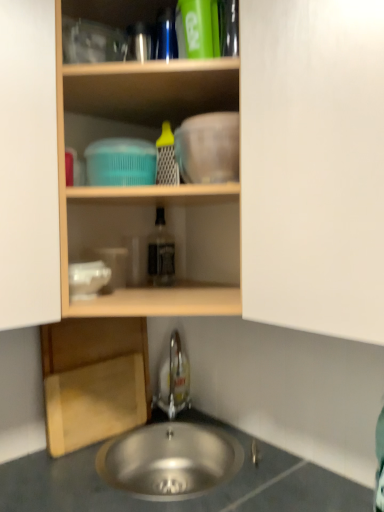
Describe the element at coordinates (184, 500) in the screenshot. This screenshot has width=384, height=512. I see `metallic gray sink at lower center` at that location.

Describe the element at coordinates (313, 165) in the screenshot. I see `white matte cabinet at center` at that location.

The width and height of the screenshot is (384, 512). What do you see at coordinates (161, 252) in the screenshot? I see `translucent glass bottle at center` at bounding box center [161, 252].

Identify the location of stainless steel sink at lower center. tap(169, 460).

In order to click on metallic gray sink at lower center in this screenshot , I will do `click(184, 500)`.

Is point (338, 84) closer or farther from the camera than point (165, 265)?

Point (338, 84) is positioned closer to the camera compared to point (165, 265).

Is white matte cabinet at center facing towards translucent glass bottle at center?

No, white matte cabinet at center is not oriented towards translucent glass bottle at center.

From the image's perspective, is white matte cabinet at center over translucent glass bottle at center?

Indeed, from the image's perspective, white matte cabinet at center is shown above translucent glass bottle at center.

From a real-world perspective, does white matte cabinet at center stand above translucent glass bottle at center?

Indeed, from a real-world perspective, white matte cabinet at center stands above translucent glass bottle at center.

From a real-world perspective, is white matte cabinet at center above or below stainless steel sink at lower center?

white matte cabinet at center is above stainless steel sink at lower center.

Considering the positions of objects white matte cabinet at center and stainless steel sink at lower center in the image provided, who is more to the right, white matte cabinet at center or stainless steel sink at lower center?

From the viewer's perspective, white matte cabinet at center appears more on the right side.

Is white matte cabinet at center taller than stainless steel sink at lower center?

Correct, white matte cabinet at center is much taller as stainless steel sink at lower center.

Can you tell me how much white matte cabinet at center and stainless steel sink at lower center differ in facing direction?

The facing directions of white matte cabinet at center and stainless steel sink at lower center are 50.5 degrees apart.

From the image's perspective, who appears lower, white matte cabinet at center or satin nickel faucet at lower center?

satin nickel faucet at lower center is shown below in the image.

Is white matte cabinet at center inside or outside of satin nickel faucet at lower center?

white matte cabinet at center lies outside satin nickel faucet at lower center.

Is white matte cabinet at center far from satin nickel faucet at lower center?

white matte cabinet at center is near satin nickel faucet at lower center, not far away.

Relative to wooden shelf at upper center, is stainless steel sink at lower center in front or behind?

Visually, stainless steel sink at lower center is located behind wooden shelf at upper center.

Is stainless steel sink at lower center located outside wooden shelf at upper center?

Yes, stainless steel sink at lower center is outside of wooden shelf at upper center.

In order to click on sink behind the wooden shelf at upper center in this screenshot , I will do `click(169, 460)`.

Measure the distance from wooden shelf at upper center to satin nickel faucet at lower center.

24.08 inches.

Is point (134, 197) in front of point (173, 395)?

Yes.

From a real-world perspective, between wooden shelf at upper center and satin nickel faucet at lower center, who is vertically higher?

wooden shelf at upper center.

Is wooden shelf at upper center spatially inside satin nickel faucet at lower center, or outside of it?

wooden shelf at upper center is not enclosed by satin nickel faucet at lower center.

Does wooden shelf at upper center lie in front of translucent glass bottle at center?

Yes.

Does point (220, 63) lie in front of point (170, 260)?

That is True.

From the picture: From the image's perspective, which one is positioned higher, wooden shelf at upper center or translucent glass bottle at center?

wooden shelf at upper center appears higher in the image.

Between wooden shelf at upper center and translucent glass bottle at center, which one has less height?

translucent glass bottle at center.

Is stainless steel sink at lower center taller than translucent glass bottle at center?

In fact, stainless steel sink at lower center may be shorter than translucent glass bottle at center.

Is stainless steel sink at lower center not inside translucent glass bottle at center?

stainless steel sink at lower center is positioned outside translucent glass bottle at center.

Based on the photo, from the image's perspective, which is below, stainless steel sink at lower center or translucent glass bottle at center?

stainless steel sink at lower center appears lower in the image.

I want to click on cabinet in front of the translucent glass bottle at center, so click(313, 165).

Locate an element on the screen. sink that appears on the left of white matte cabinet at center is located at coordinates (169, 460).

Which object lies nearer to the anchor point white matte cabinet at center, translucent glass bottle at center or stainless steel sink at lower center?

Based on the image, translucent glass bottle at center appears to be nearer to white matte cabinet at center.

Considering their positions, is wooden cutting board at lower left positioned closer to stainless steel sink at lower center than satin nickel faucet at lower center?

wooden cutting board at lower left is positioned closer to the anchor stainless steel sink at lower center.

From the image, which object appears to be farther from satin nickel faucet at lower center, metallic gray sink at lower center or white matte cabinet at center?

Based on the image, white matte cabinet at center appears to be further to satin nickel faucet at lower center.

From the image, which object appears to be nearer to wooden cutting board at lower left, wooden shelf at upper center or metallic gray sink at lower center?

The object closer to wooden cutting board at lower left is metallic gray sink at lower center.

Looking at the image, which one is located closer to wooden shelf at upper center, wooden cutting board at lower left or satin nickel faucet at lower center?

wooden cutting board at lower left is positioned closer to the anchor wooden shelf at upper center.

Considering their positions, is wooden cutting board at lower left positioned closer to stainless steel sink at lower center than metallic gray sink at lower center?

The object closer to stainless steel sink at lower center is metallic gray sink at lower center.

Estimate the real-world distances between objects in this image. Which object is closer to wooden cutting board at lower left, stainless steel sink at lower center or satin nickel faucet at lower center?

stainless steel sink at lower center lies closer to wooden cutting board at lower left than the other object.

When comparing their distances from wooden shelf at upper center, does translucent glass bottle at center or satin nickel faucet at lower center seem closer?

The object closer to wooden shelf at upper center is translucent glass bottle at center.

Identify the location of bottle between white matte cabinet at center and stainless steel sink at lower center from top to bottom. The width and height of the screenshot is (384, 512). (161, 252).

This screenshot has height=512, width=384. Find the location of `bottle that lies between white matte cabinet at center and metallic gray sink at lower center from top to bottom`. bottle that lies between white matte cabinet at center and metallic gray sink at lower center from top to bottom is located at coordinates (161, 252).

The height and width of the screenshot is (512, 384). What are the coordinates of `cabinetry that lies between translucent glass bottle at center and metallic gray sink at lower center from top to bottom` in the screenshot? It's located at (94, 379).

At what (x,y) coordinates should I click in order to perform the action: click on cabinetry between white matte cabinet at center and metallic gray sink at lower center in the vertical direction. Please return your answer as a coordinate pair (x, y). The height and width of the screenshot is (512, 384). Looking at the image, I should click on (94, 379).